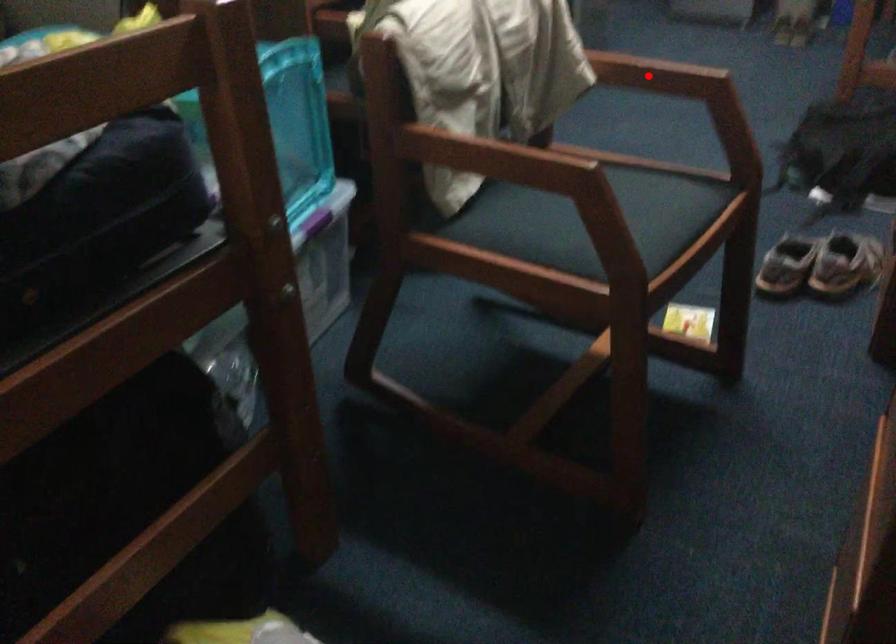
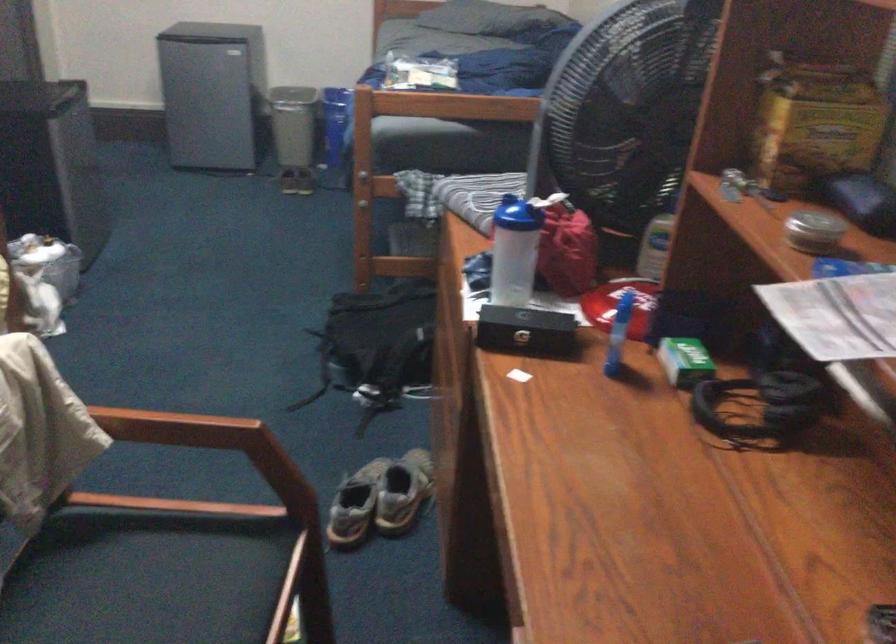
Find the pixel in the second image that matches the highlighted location in the first image.

(176, 428)